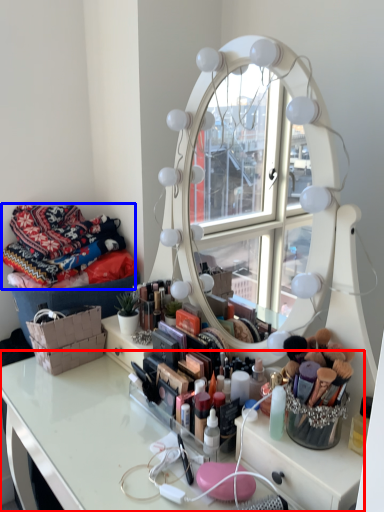
Question: Which point is closer to the camera, table (highlighted by a red box) or material (highlighted by a blue box)?

Choices:
 (A) table
 (B) material

Answer: (A)